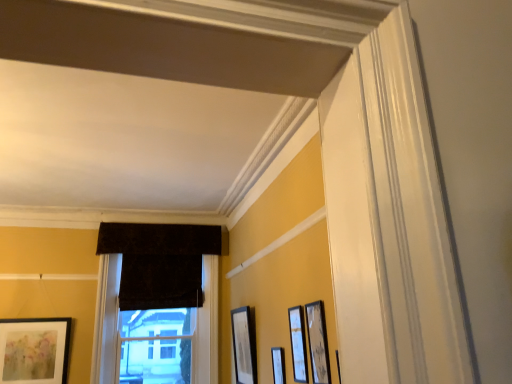
In order to face matte black picture frame at center, the 4th picture frame when ordered from left to right, should I rotate leftwards or rightwards?

You should rotate right by 5.654 degrees.

Measure the distance between matte black picture frame at center, the 4th picture frame in the front-to-back sequence, and camera.

They are 3.88 meters apart.

At what (x,y) coordinates should I click in order to perform the action: click on wooden picture frame at right, the first picture frame when ordered from front to back. Please return your answer as a coordinate pair (x, y). This screenshot has width=512, height=384. Looking at the image, I should click on (318, 343).

What are the coordinates of `matte black picture frame at lower right, which is the third picture frame in left-to-right order` in the screenshot? It's located at (278, 365).

The image size is (512, 384). What do you see at coordinates (34, 350) in the screenshot?
I see `matte black picture frame at lower left, arranged as the fifth picture frame when viewed from the right` at bounding box center [34, 350].

Where is `matte black picture frame at lower left, arranged as the fifth picture frame when viewed from the right`? The image size is (512, 384). matte black picture frame at lower left, arranged as the fifth picture frame when viewed from the right is located at coordinates (34, 350).

I want to click on dark velvet curtain at center, so click(x=160, y=282).

Where is `matte black picture frame at center, the 4th picture frame when ordered from left to right`? This screenshot has height=384, width=512. matte black picture frame at center, the 4th picture frame when ordered from left to right is located at coordinates (298, 344).

Which is less distant, (206, 259) or (274, 379)?

The point (274, 379) is more forward.

Does velvet dark brown window at center have a greater height compared to matte black picture frame at lower right, the third picture frame in the right-to-left sequence?

Correct, velvet dark brown window at center is much taller as matte black picture frame at lower right, the third picture frame in the right-to-left sequence.

Is velvet dark brown window at center not close to matte black picture frame at lower right, which is the third picture frame in left-to-right order?

Yes, velvet dark brown window at center and matte black picture frame at lower right, which is the third picture frame in left-to-right order, are located far from each other.

From a real-world perspective, is velvet dark brown window at center positioned over matte black picture frame at center, the 4th picture frame positioned from the back, based on gravity?

Yes, from a real-world perspective, velvet dark brown window at center is above matte black picture frame at center, the 4th picture frame positioned from the back.

Which point is more forward, [106,254] or [302,347]?

The point [302,347] is more forward.

Is velvet dark brown window at center aimed at matte black picture frame at center, the 4th picture frame when ordered from left to right?

Yes, velvet dark brown window at center is aimed at matte black picture frame at center, the 4th picture frame when ordered from left to right.

The image size is (512, 384). I want to click on window above the matte black picture frame at center, the second picture frame viewed from the right (from a real-world perspective), so click(157, 300).

Does matte black picture frame at center, acting as the second picture frame starting from the front, have a lesser width compared to matte black picture frame at lower right, the third picture frame in the right-to-left sequence?

Correct, the width of matte black picture frame at center, acting as the second picture frame starting from the front, is less than that of matte black picture frame at lower right, the third picture frame in the right-to-left sequence.

Are matte black picture frame at center, the 4th picture frame positioned from the back, and matte black picture frame at lower right, positioned as the 3th picture frame in front-to-back order, located far from each other?

No, matte black picture frame at center, the 4th picture frame positioned from the back, is in close proximity to matte black picture frame at lower right, positioned as the 3th picture frame in front-to-back order.

Measure the distance from matte black picture frame at center, the 4th picture frame when ordered from left to right, to matte black picture frame at lower right, which is the third picture frame in left-to-right order.

matte black picture frame at center, the 4th picture frame when ordered from left to right, and matte black picture frame at lower right, which is the third picture frame in left-to-right order, are 14.50 inches apart.

From the picture: Which point is more forward, (x=296, y=320) or (x=282, y=348)?

The point (x=296, y=320) is closer.

Is matte black picture frame at lower right, which is the third picture frame in left-to-right order, not inside dark velvet curtain at center?

That's correct, matte black picture frame at lower right, which is the third picture frame in left-to-right order, is outside of dark velvet curtain at center.

Is matte black picture frame at lower right, the third picture frame in the right-to-left sequence, positioned in front of dark velvet curtain at center?

Yes.

From a real-world perspective, which object rests below the other?

matte black picture frame at lower right, positioned as the 3th picture frame in front-to-back order, from a real-world perspective.

The image size is (512, 384). I want to click on picture frame lying on the left of matte black picture frame at center, the 4th picture frame in the front-to-back sequence, so click(34, 350).

Is matte black picture frame at center, which is the 2th picture frame in left-to-right order, completely or partially inside matte black picture frame at lower left, arranged as the fifth picture frame when viewed from the right?

Definitely not — matte black picture frame at center, which is the 2th picture frame in left-to-right order, is not inside matte black picture frame at lower left, arranged as the fifth picture frame when viewed from the right.

Can you tell me how much matte black picture frame at lower left, arranged as the fifth picture frame when viewed from the right, and matte black picture frame at center, placed as the 2th picture frame when sorted from back to front, differ in facing direction?

90.9 degrees separate the facing orientations of matte black picture frame at lower left, arranged as the fifth picture frame when viewed from the right, and matte black picture frame at center, placed as the 2th picture frame when sorted from back to front.

From a real-world perspective, is matte black picture frame at lower left, the 1th picture frame positioned from the back, positioned above or below matte black picture frame at center, which is the 2th picture frame in left-to-right order?

From a real-world perspective, matte black picture frame at lower left, the 1th picture frame positioned from the back, is physically above matte black picture frame at center, which is the 2th picture frame in left-to-right order.

Can you tell me how much dark velvet curtain at center and matte black picture frame at center, placed as the 2th picture frame when sorted from back to front, differ in facing direction?

There is a 91.5-degree angle between the facing directions of dark velvet curtain at center and matte black picture frame at center, placed as the 2th picture frame when sorted from back to front.

Based on the photo, how distant is dark velvet curtain at center from matte black picture frame at center, placed as the 2th picture frame when sorted from back to front?

dark velvet curtain at center and matte black picture frame at center, placed as the 2th picture frame when sorted from back to front, are 1.35 meters apart.

Would you say dark velvet curtain at center is to the left or to the right of matte black picture frame at center, placed as the 2th picture frame when sorted from back to front, in the picture?

From the image, it's evident that dark velvet curtain at center is to the left of matte black picture frame at center, placed as the 2th picture frame when sorted from back to front.

Is dark velvet curtain at center located outside matte black picture frame at center, placed as the 2th picture frame when sorted from back to front?

Yes, dark velvet curtain at center is outside of matte black picture frame at center, placed as the 2th picture frame when sorted from back to front.

Does wooden picture frame at right, the 5th picture frame when ordered from back to front, have a greater width compared to matte black picture frame at lower right, which is the third picture frame in left-to-right order?

Yes.

Is wooden picture frame at right, positioned as the 5th picture frame in left-to-right order, beside matte black picture frame at lower right, which is the third picture frame in left-to-right order?

No, wooden picture frame at right, positioned as the 5th picture frame in left-to-right order, is not next to matte black picture frame at lower right, which is the third picture frame in left-to-right order.

The width and height of the screenshot is (512, 384). I want to click on the 4th picture frame positioned below the wooden picture frame at right, the 5th picture frame when ordered from back to front (from a real-world perspective), so click(278, 365).

This screenshot has height=384, width=512. In order to click on the 5th picture frame below the velvet dark brown window at center (from a real-world perspective) in this screenshot , I will do `click(278, 365)`.

What are the coordinates of `picture frame that is the 4th object located in front of the velvet dark brown window at center` in the screenshot? It's located at (298, 344).

Which object lies nearer to the anchor point wooden picture frame at right, the 5th picture frame when ordered from back to front, matte black picture frame at lower left, which is the 5th picture frame in front-to-back order, or dark velvet curtain at center?

dark velvet curtain at center.

Based on their spatial positions, is matte black picture frame at lower right, which is the third picture frame in left-to-right order, or wooden picture frame at right, positioned as the 5th picture frame in left-to-right order, further from matte black picture frame at center, placed as the 2th picture frame when sorted from back to front?

wooden picture frame at right, positioned as the 5th picture frame in left-to-right order, is further to matte black picture frame at center, placed as the 2th picture frame when sorted from back to front.

When comparing their distances from velvet dark brown window at center, does matte black picture frame at lower left, which is the first picture frame in left-to-right order, or matte black picture frame at center, which is counted as the fourth picture frame, starting from the right, seem further?

Based on the image, matte black picture frame at center, which is counted as the fourth picture frame, starting from the right, appears to be further to velvet dark brown window at center.

When comparing their distances from dark velvet curtain at center, does matte black picture frame at lower left, which is the first picture frame in left-to-right order, or velvet dark brown window at center seem closer?

velvet dark brown window at center is closer to dark velvet curtain at center.

Based on their spatial positions, is matte black picture frame at lower right, positioned as the third picture frame in back-to-front order, or matte black picture frame at center, which is the 2th picture frame in left-to-right order, further from velvet dark brown window at center?

The object further to velvet dark brown window at center is matte black picture frame at lower right, positioned as the third picture frame in back-to-front order.

From the image, which object appears to be nearer to matte black picture frame at center, which is counted as the fourth picture frame, starting from the right, wooden picture frame at right, placed as the first picture frame when sorted from right to left, or matte black picture frame at lower left, the 1th picture frame positioned from the back?

wooden picture frame at right, placed as the first picture frame when sorted from right to left, is positioned closer to the anchor matte black picture frame at center, which is counted as the fourth picture frame, starting from the right.

Considering their positions, is matte black picture frame at center, the 4th picture frame in the front-to-back sequence, positioned further to matte black picture frame at lower right, positioned as the 3th picture frame in front-to-back order, than dark velvet curtain at center?

dark velvet curtain at center lies further to matte black picture frame at lower right, positioned as the 3th picture frame in front-to-back order, than the other object.

Which object lies nearer to the anchor point velvet dark brown window at center, matte black picture frame at lower right, which is the third picture frame in left-to-right order, or matte black picture frame at lower left, which is the 5th picture frame in front-to-back order?

matte black picture frame at lower left, which is the 5th picture frame in front-to-back order, lies closer to velvet dark brown window at center than the other object.

You are a GUI agent. You are given a task and a screenshot of the screen. Output one action in this format:
    pyautogui.click(x=<x>, y=<y>)
    Task: Click on the window between matte black picture frame at lower left, arranged as the fifth picture frame when viewed from the right, and matte black picture frame at center, the 4th picture frame in the front-to-back sequence, from left to right
    This screenshot has height=384, width=512.
    Given the screenshot: What is the action you would take?
    pyautogui.click(x=157, y=300)

The height and width of the screenshot is (384, 512). I want to click on curtain situated between velvet dark brown window at center and matte black picture frame at center, which is counted as the fourth picture frame, starting from the right, from left to right, so click(x=160, y=282).

What are the coordinates of `window between matte black picture frame at lower left, the 1th picture frame positioned from the back, and matte black picture frame at lower right, which is the third picture frame in left-to-right order` in the screenshot? It's located at (157, 300).

This screenshot has width=512, height=384. Identify the location of window between matte black picture frame at lower right, the third picture frame in the right-to-left sequence, and dark velvet curtain at center from front to back. (157, 300).